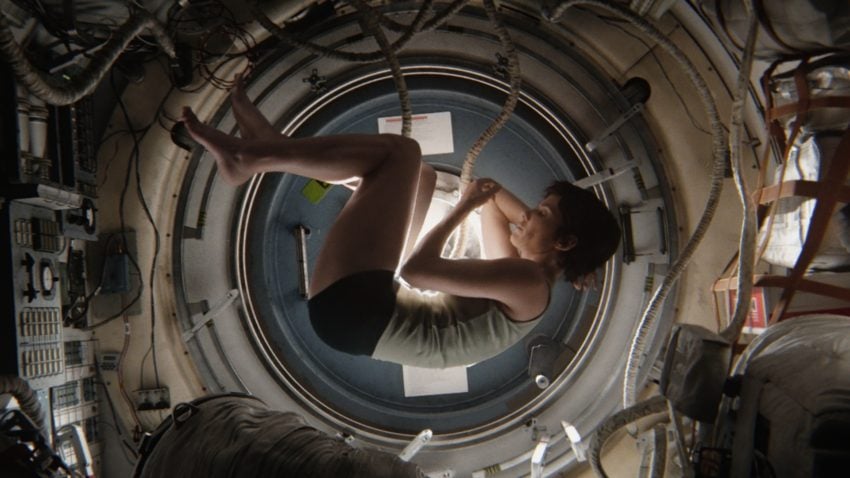
Locate an element on the screen. The width and height of the screenshot is (850, 478). control panel, grey metal is located at coordinates (30, 297).